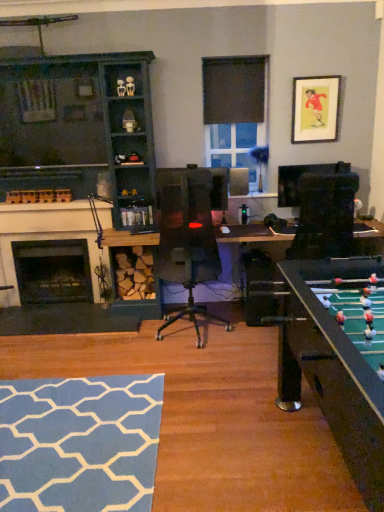
The width and height of the screenshot is (384, 512). What are the coordinates of `free point above white painted wood fireplace at left, the 1th fireplace in the front-to-back sequence (from a real-world perspective)` in the screenshot? It's located at (48, 210).